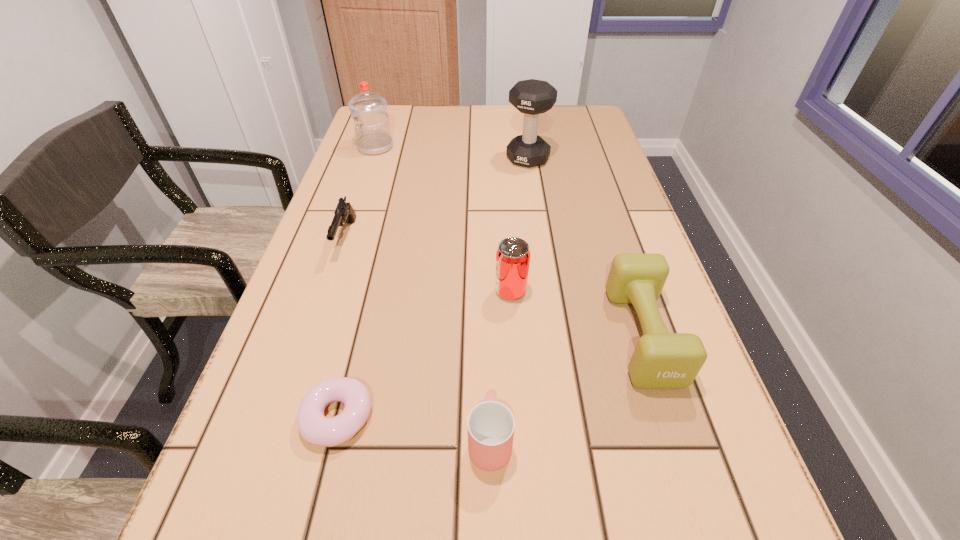
The image size is (960, 540). Identify the location of doughnut located at the left edge. (315, 428).

The image size is (960, 540). I want to click on object positioned at the right edge, so click(x=661, y=360).

The image size is (960, 540). In order to click on object that is at the far left corner in this screenshot , I will do `click(373, 136)`.

The height and width of the screenshot is (540, 960). In the image, there is a desktop. What are the coordinates of `vacant region at the far edge` in the screenshot? It's located at (497, 116).

The height and width of the screenshot is (540, 960). In the image, there is a desktop. In order to click on vacant space at the left edge in this screenshot , I will do `click(345, 178)`.

The image size is (960, 540). In the image, there is a desktop. What are the coordinates of `vacant space at the right edge` in the screenshot? It's located at (615, 199).

Identify the location of free space at the far right corner. (562, 129).

I want to click on vacant space that is in between the third farthest object and the soda can, so click(428, 265).

Image resolution: width=960 pixels, height=540 pixels. Identify the location of vacant area between the gun and the taller dumbbell. (437, 199).

Identify the location of vacant area between the shortest object and the cup. (414, 429).